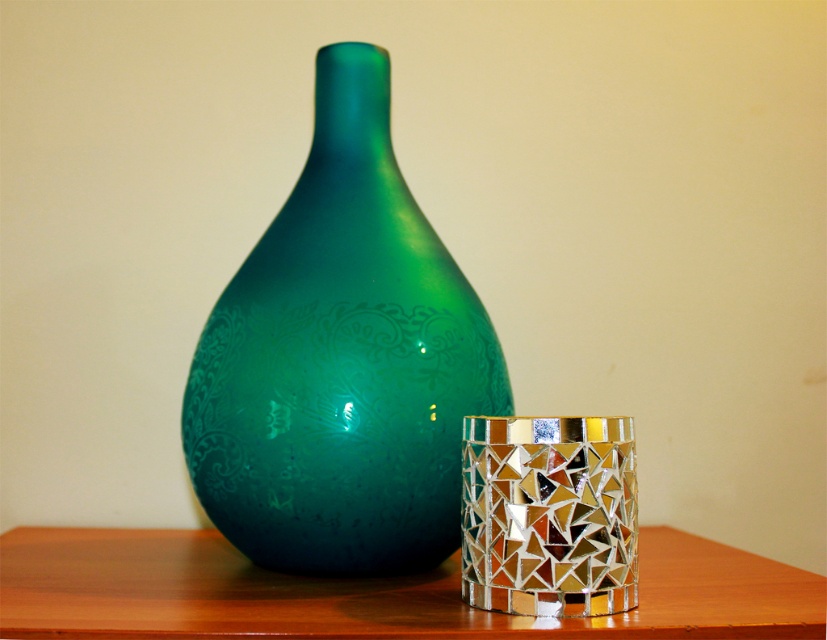
Consider the image. You are arranging flowers in the green glossy vase at center and need to place it on the wooden table at center. Will the vase fit on the table without falling over?

The green glossy vase at center is taller than the wooden table at center, so it may not fit properly and could potentially tip over. Ensure the table is stable or choose a shorter vase.

You are standing in front of a wooden surface with two points marked. The first point is at coordinates point (314,400) and the second is at point (532,492). Which point is closer to you?

Point (314,400) is closer to you because it is further to the viewer than point (532,492).